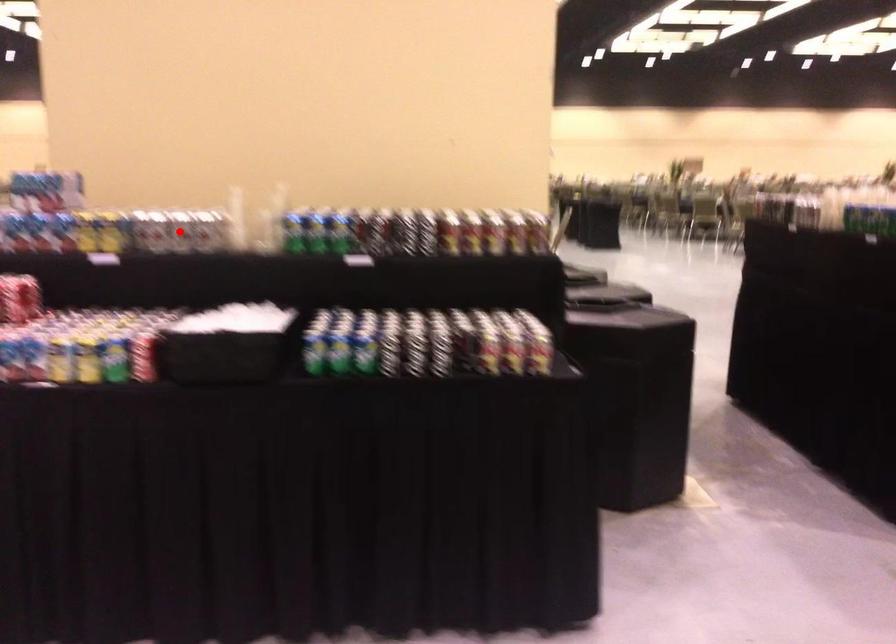
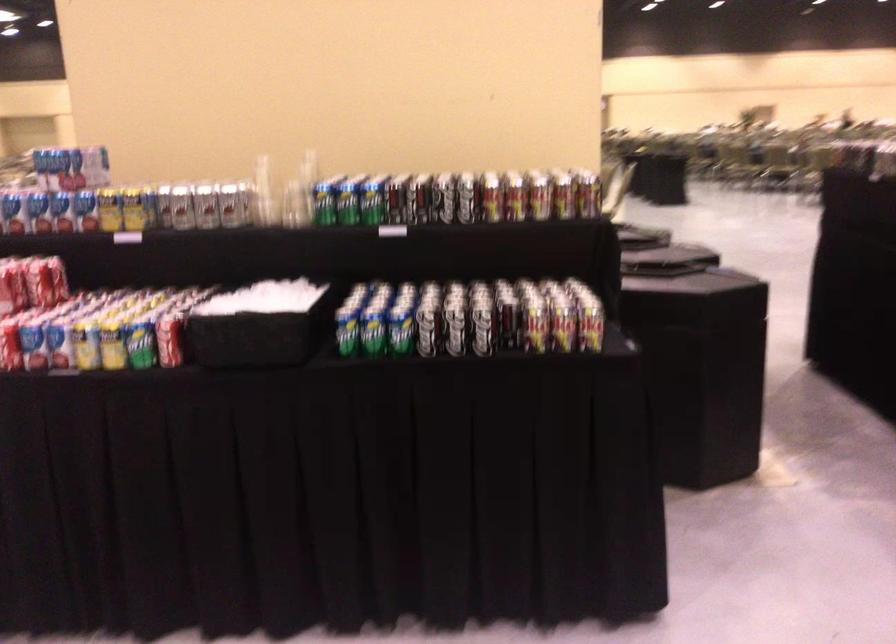
Find the pixel in the second image that matches the highlighted location in the first image.

(205, 205)